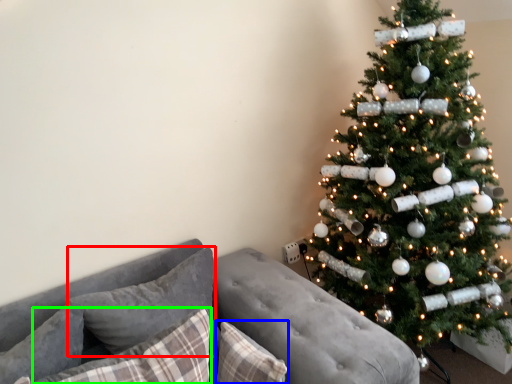
Question: Which is nearer to the pillow (highlighted by a red box)? pillow (highlighted by a blue box) or pillow (highlighted by a green box).

Choices:
 (A) pillow
 (B) pillow

Answer: (B)